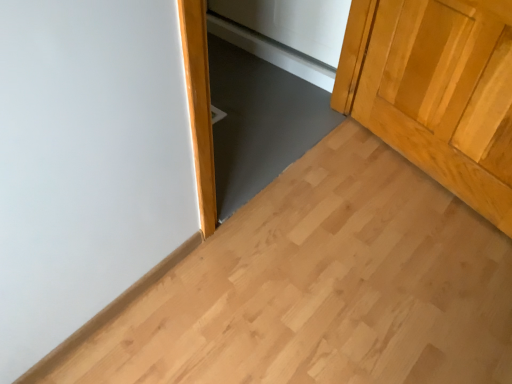
Locate an element on the screen. Image resolution: width=512 pixels, height=384 pixels. light brown wood door at right is located at coordinates (436, 91).

The height and width of the screenshot is (384, 512). What do you see at coordinates (436, 91) in the screenshot?
I see `light brown wood door at right` at bounding box center [436, 91].

Identify the location of light brown wood door at right. (436, 91).